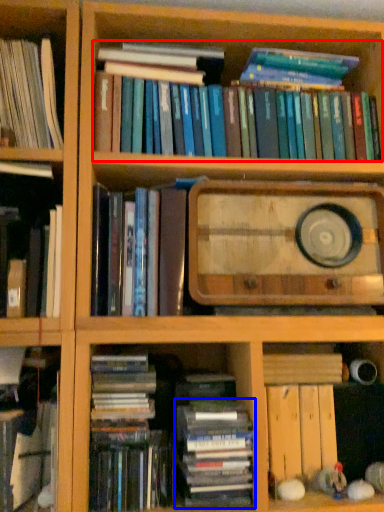
Question: Which object appears closest to the camera in this image, book (highlighted by a red box) or book (highlighted by a blue box)?

Choices:
 (A) book
 (B) book

Answer: (B)